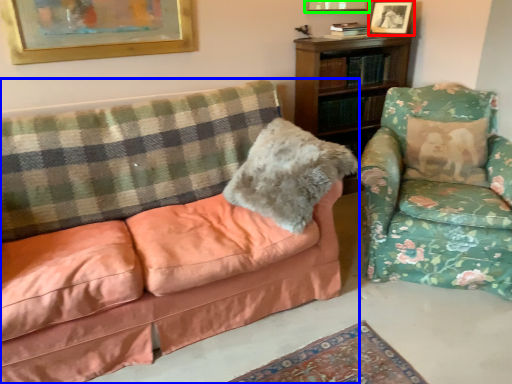
Question: Which object is the farthest from picture frame (highlighted by a red box)? Choose among these: studio couch (highlighted by a blue box) or picture frame (highlighted by a green box).

Choices:
 (A) studio couch
 (B) picture frame

Answer: (A)